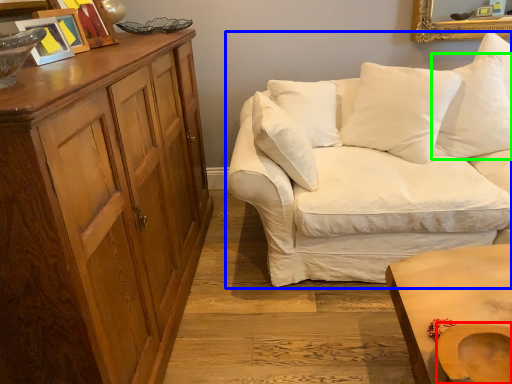
Question: Based on their relative distances, which object is farther from swivel chair (highlighted by a red box)? Choose from studio couch (highlighted by a blue box) and pillow (highlighted by a green box).

Choices:
 (A) studio couch
 (B) pillow

Answer: (B)